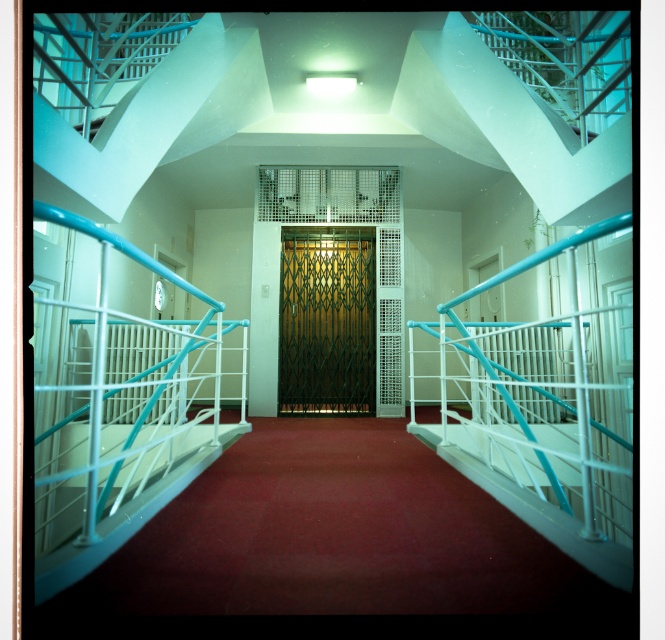
Where is `metallic gold elevator at center`? Image resolution: width=665 pixels, height=640 pixels. metallic gold elevator at center is located at coordinates (327, 225).

Does metallic gold elevator at center lie in front of green textured door at center?

Yes, it is.

This screenshot has height=640, width=665. What do you see at coordinates (327, 225) in the screenshot?
I see `metallic gold elevator at center` at bounding box center [327, 225].

You are a GUI agent. You are given a task and a screenshot of the screen. Output one action in this format:
    pyautogui.click(x=<x>, y=<y>)
    Task: Click on the metallic gold elevator at center
    This screenshot has width=665, height=640.
    Given the screenshot: What is the action you would take?
    pyautogui.click(x=327, y=225)